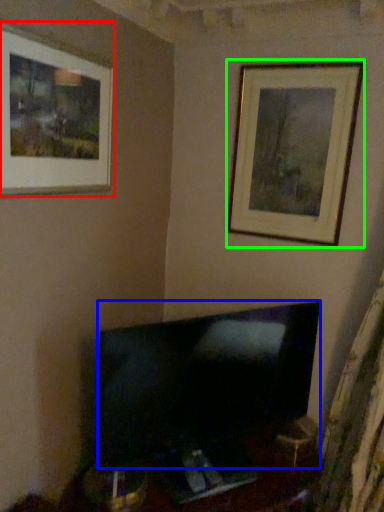
Question: Which object is the farthest from picture frame (highlighted by a red box)? Choose among these: television (highlighted by a blue box) or picture frame (highlighted by a green box).

Choices:
 (A) television
 (B) picture frame

Answer: (A)